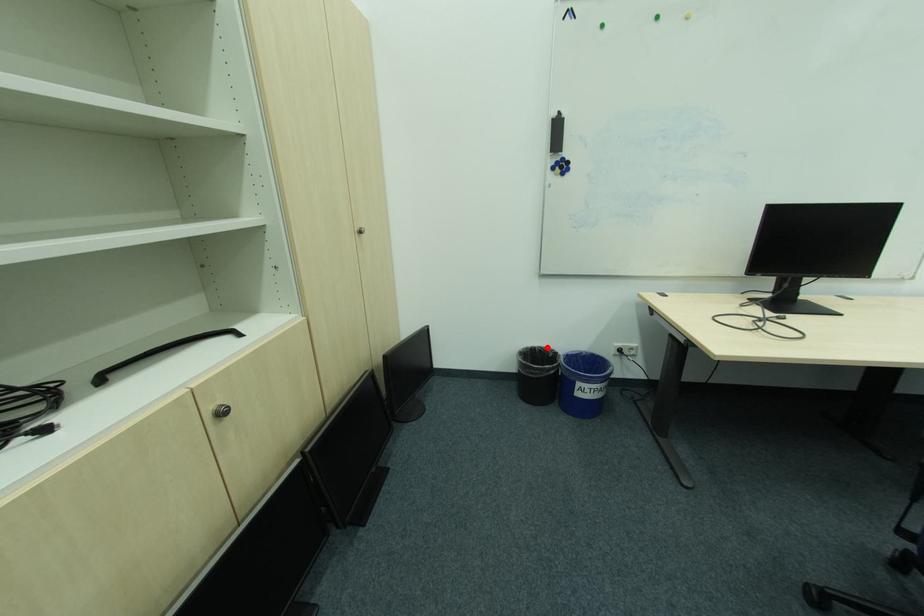
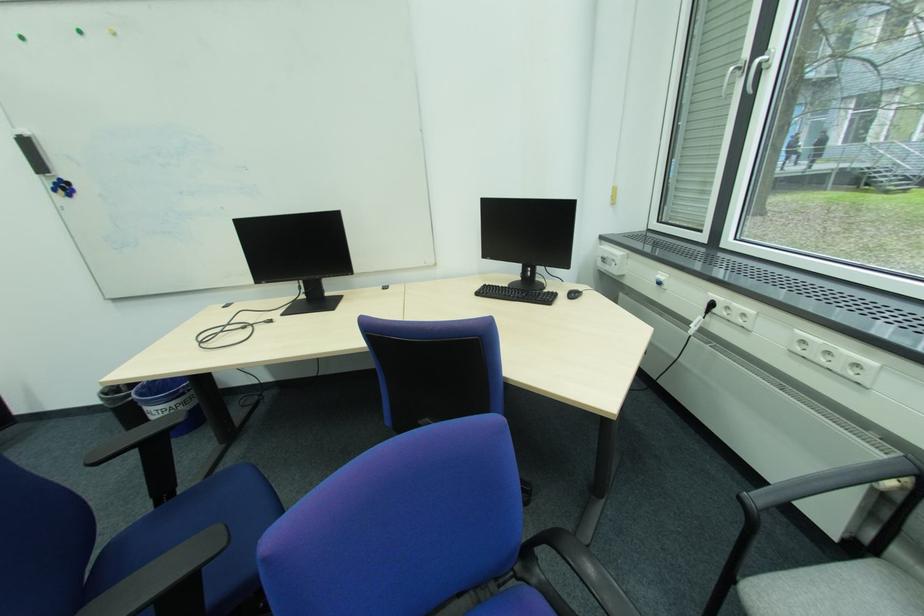
Question: I am providing you with two images of the same scene from different viewpoints. A red point is marked on the first image. At the location where the point appears in image 1, is it still visible in image 2?

Choices:
 (A) Yes
 (B) No

Answer: (B)